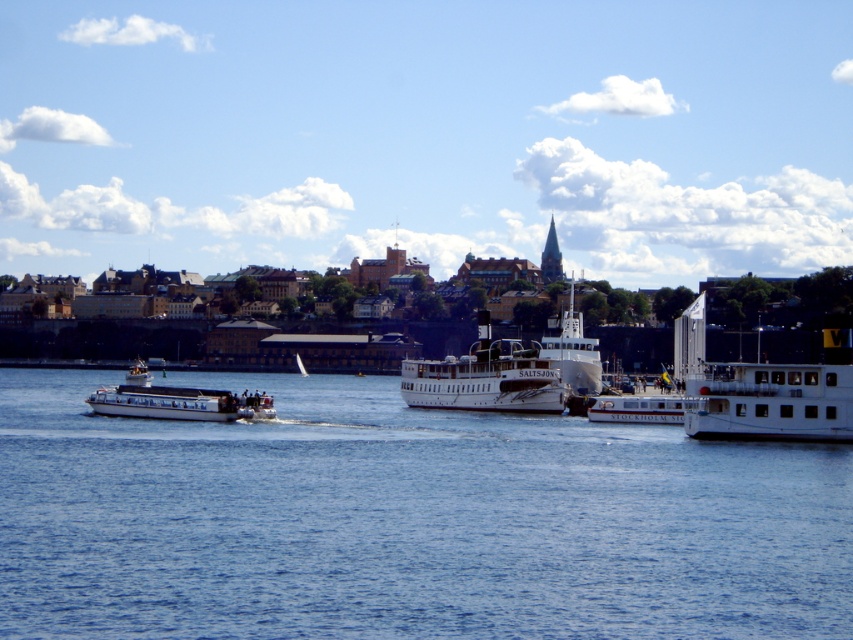
Based on the photo, does blue water at center have a greater height compared to white matte ferry at center?

No.

Image resolution: width=853 pixels, height=640 pixels. What do you see at coordinates (404, 522) in the screenshot?
I see `blue water at center` at bounding box center [404, 522].

You are a GUI agent. You are given a task and a screenshot of the screen. Output one action in this format:
    pyautogui.click(x=<x>, y=<y>)
    Task: Click on the blue water at center
    The height and width of the screenshot is (640, 853).
    Given the screenshot: What is the action you would take?
    pyautogui.click(x=404, y=522)

Where is `blue water at center`? The height and width of the screenshot is (640, 853). blue water at center is located at coordinates (404, 522).

Consider the image. Does blue water at center appear on the left side of white glossy ferry at center?

Indeed, blue water at center is positioned on the left side of white glossy ferry at center.

Who is more distant from viewer, (735, 620) or (584, 349)?

The point (584, 349) is behind.

Find the location of a particular element. The height and width of the screenshot is (640, 853). blue water at center is located at coordinates (404, 522).

Does white glossy boat at left have a smaller size compared to white glossy boat at center?

No.

Does white glossy boat at left have a lesser width compared to white glossy boat at center?

In fact, white glossy boat at left might be wider than white glossy boat at center.

The image size is (853, 640). Describe the element at coordinates (177, 401) in the screenshot. I see `white glossy boat at left` at that location.

The height and width of the screenshot is (640, 853). I want to click on white glossy boat at left, so 177,401.